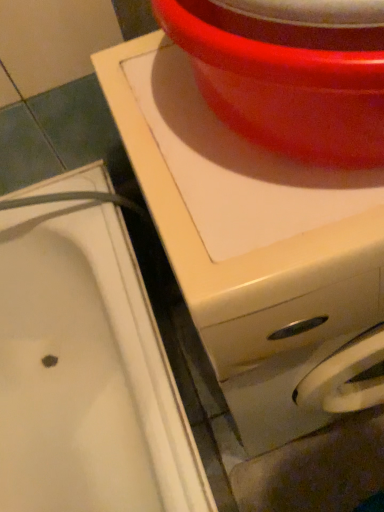
Question: Considering the relative sizes of white glossy sink at lower left and glossy plastic basin at upper center in the image provided, is white glossy sink at lower left thinner than glossy plastic basin at upper center?

Choices:
 (A) yes
 (B) no

Answer: (B)

Question: Is white glossy sink at lower left oriented towards glossy plastic basin at upper center?

Choices:
 (A) no
 (B) yes

Answer: (A)

Question: Is white glossy sink at lower left not near glossy plastic basin at upper center?

Choices:
 (A) no
 (B) yes

Answer: (A)

Question: From the image's perspective, is white glossy sink at lower left located above glossy plastic basin at upper center?

Choices:
 (A) no
 (B) yes

Answer: (A)

Question: Is glossy plastic basin at upper center inside white glossy sink at lower left?

Choices:
 (A) yes
 (B) no

Answer: (B)

Question: From the image's perspective, relative to white glossy sink at lower left, is glossy plastic basin at upper center above or below?

Choices:
 (A) above
 (B) below

Answer: (A)

Question: Is glossy plastic basin at upper center spatially inside white glossy sink at lower left, or outside of it?

Choices:
 (A) outside
 (B) inside

Answer: (A)

Question: From a real-world perspective, is glossy plastic basin at upper center physically located above or below white glossy sink at lower left?

Choices:
 (A) below
 (B) above

Answer: (B)

Question: Is point (359, 154) closer or farther from the camera than point (3, 212)?

Choices:
 (A) farther
 (B) closer

Answer: (B)

Question: Is white glossy washing machine at upper center to the left or to the right of glossy plastic basin at upper center in the image?

Choices:
 (A) left
 (B) right

Answer: (B)

Question: Is white glossy washing machine at upper center wider or thinner than glossy plastic basin at upper center?

Choices:
 (A) thin
 (B) wide

Answer: (B)

Question: Does point (382, 280) appear closer or farther from the camera than point (332, 48)?

Choices:
 (A) closer
 (B) farther

Answer: (B)

Question: Do you think white glossy washing machine at upper center is within glossy plastic basin at upper center, or outside of it?

Choices:
 (A) outside
 (B) inside

Answer: (A)

Question: From their relative heights in the image, would you say white glossy sink at lower left is taller or shorter than glossy plastic basin at upper center?

Choices:
 (A) short
 (B) tall

Answer: (B)

Question: From a real-world perspective, is white glossy sink at lower left above or below glossy plastic basin at upper center?

Choices:
 (A) below
 (B) above

Answer: (A)